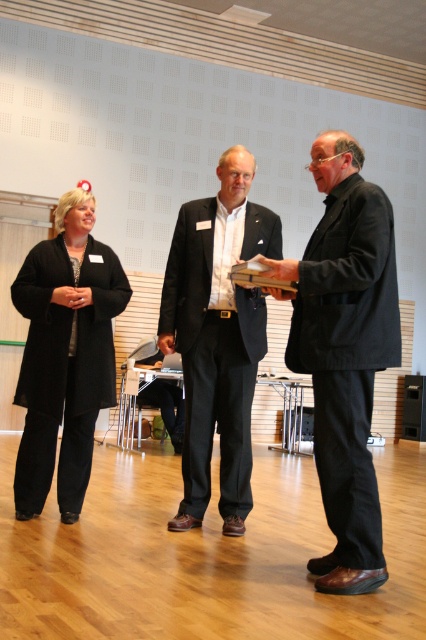
Can you confirm if black matte suit at center is positioned above black fabric coat at left?

Yes.

Is point (204, 346) in front of point (112, 256)?

Yes, it is.

The image size is (426, 640). In order to click on black matte suit at center in this screenshot , I will do `click(218, 337)`.

Is point (377, 260) behind point (203, 438)?

No, it is not.

Between dark gray suit at center and black matte suit at center, which one has more height?

Standing taller between the two is black matte suit at center.

You are a GUI agent. You are given a task and a screenshot of the screen. Output one action in this format:
    pyautogui.click(x=<x>, y=<y>)
    Task: Click on the dark gray suit at center
    
    Given the screenshot: What is the action you would take?
    pyautogui.click(x=345, y=352)

How distant is dark gray suit at center from black fabric coat at left?

5.12 feet

Is point (373, 296) closer to camera compared to point (48, 243)?

Yes, it is.

Between point (365, 310) and point (43, 497), which one is positioned in front?

Point (365, 310)

This screenshot has width=426, height=640. Identify the location of dark gray suit at center. (345, 352).